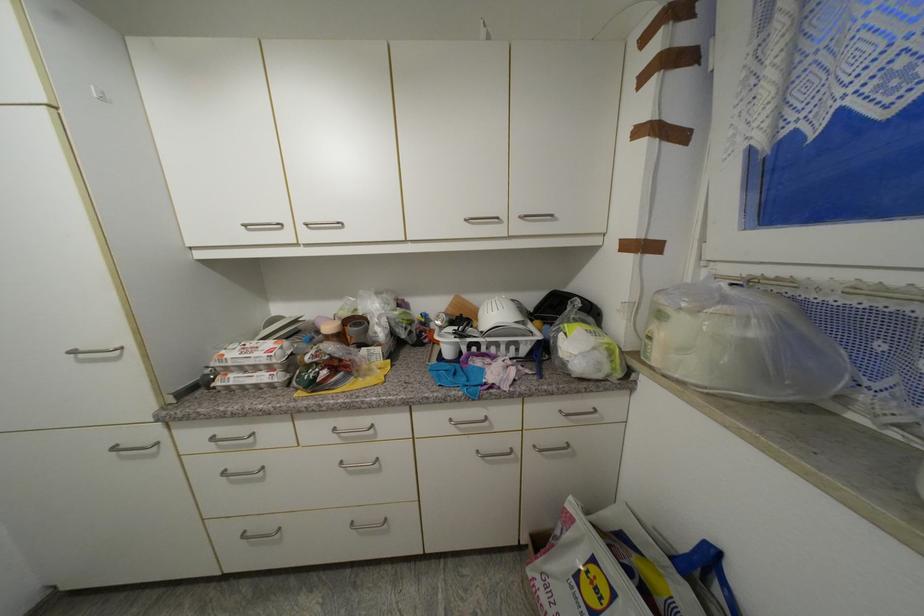
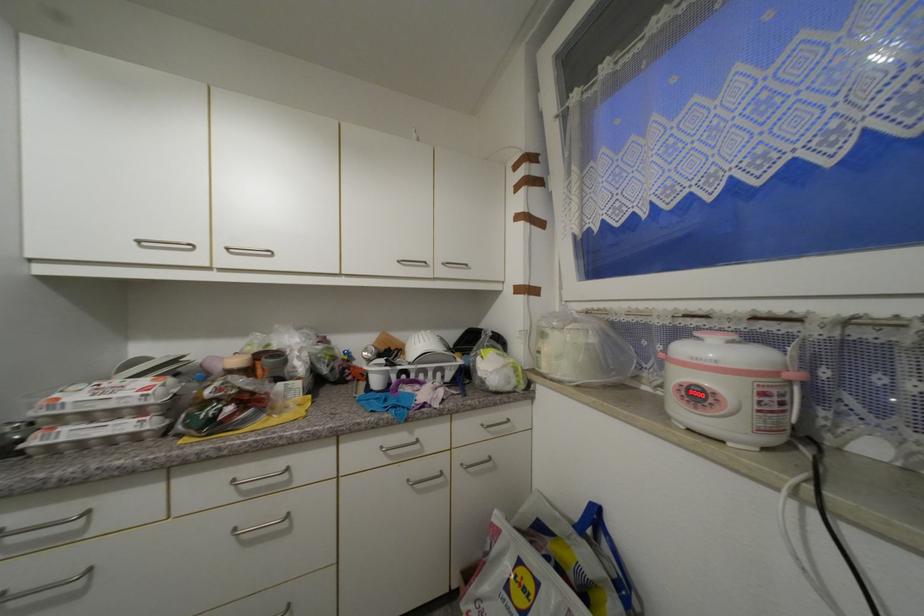
Locate, in the second image, the point that corresponds to (526,217) in the first image.

(448, 265)